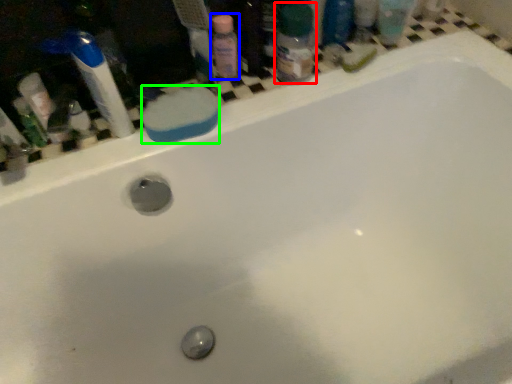
Question: Which is nearer to the toiletry (highlighted by a red box)? cleaning product (highlighted by a blue box) or soap (highlighted by a green box).

Choices:
 (A) cleaning product
 (B) soap

Answer: (A)